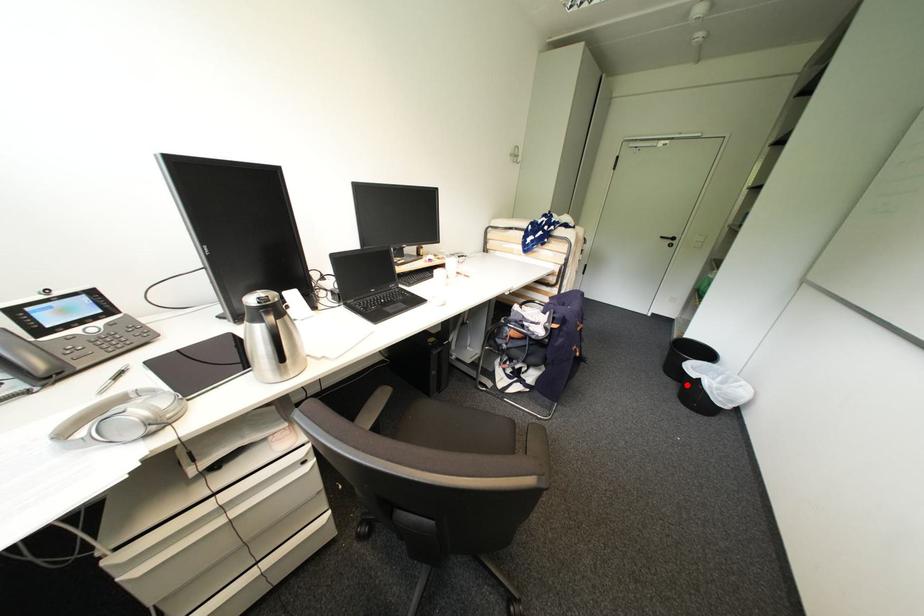
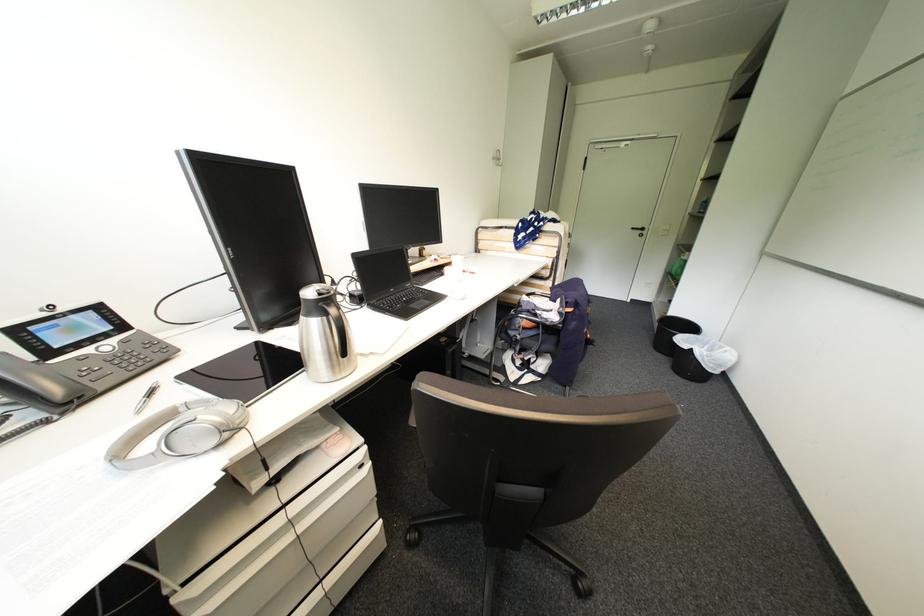
Question: I am providing you with two images of the same scene from different viewpoints. Image1 has a red point marked. In image2, the corresponding 3D location appears at what relative position? Reply with the corresponding letter.

Choices:
 (A) Closer
 (B) Farther

Answer: (A)